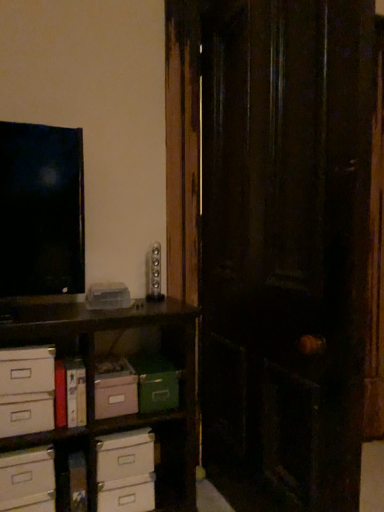
You are a GUI agent. You are given a task and a screenshot of the screen. Output one action in this format:
    pyautogui.click(x=<x>, y=<y>)
    Task: Click on the vacant space situated above white cardboard drawer at lower left, which is the 3th drawer from bottom to top (from a real-world perspective)
    This screenshot has width=384, height=512.
    Given the screenshot: What is the action you would take?
    pyautogui.click(x=22, y=345)